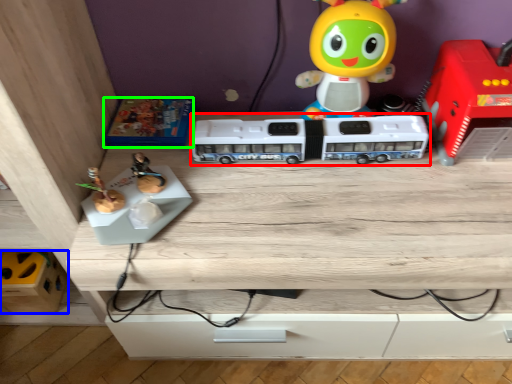
Question: Which object is positioned closest to toy (highlighted by a red box)? Select from toy (highlighted by a blue box) and toy (highlighted by a green box).

Choices:
 (A) toy
 (B) toy

Answer: (B)